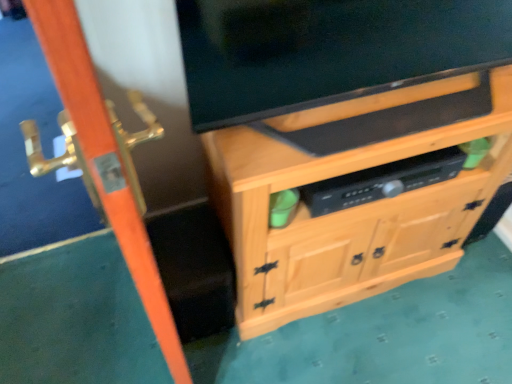
Question: Considering the positions of natural wood cabinet at center and matte black tv at upper center in the image, is natural wood cabinet at center taller or shorter than matte black tv at upper center?

Choices:
 (A) short
 (B) tall

Answer: (B)

Question: Based on their positions, is natural wood cabinet at center located to the left or right of matte black tv at upper center?

Choices:
 (A) right
 (B) left

Answer: (A)

Question: Which of these objects is positioned farthest from the black plastic speaker at center?

Choices:
 (A) matte black tv at upper center
 (B) natural wood cabinet at center
 (C) orange wood screen door at left

Answer: (C)

Question: Which object is positioned farthest from the matte black tv at upper center?

Choices:
 (A) orange wood screen door at left
 (B) black plastic speaker at center
 (C) natural wood cabinet at center

Answer: (A)